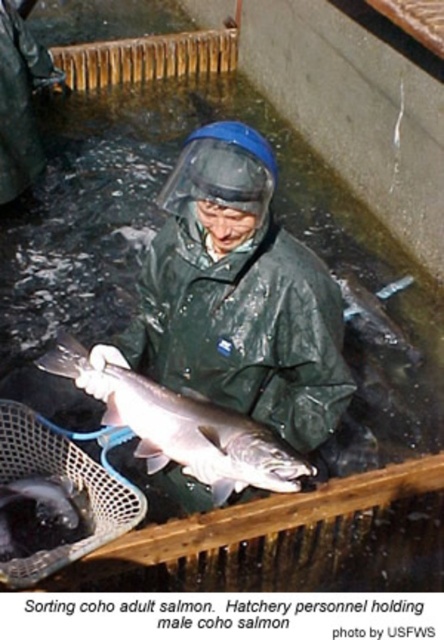
Question: Which point is closer to the camera?

Choices:
 (A) shiny black fish at lower left
 (B) shiny silver fish at center
 (C) green matte jacket at center

Answer: (B)

Question: Can you confirm if shiny silver fish at center is smaller than shiny black fish at lower left?

Choices:
 (A) no
 (B) yes

Answer: (A)

Question: Which point is closer to the camera?

Choices:
 (A) shiny silver fish at center
 (B) shiny black fish at lower left
 (C) green matte jacket at center

Answer: (A)

Question: Among these objects, which one is nearest to the camera?

Choices:
 (A) shiny silver fish at center
 (B) green matte jacket at center
 (C) shiny black fish at lower left

Answer: (A)

Question: Is green matte jacket at center closer to camera compared to shiny silver fish at center?

Choices:
 (A) yes
 (B) no

Answer: (B)

Question: Does green matte jacket at center have a larger size compared to shiny silver fish at center?

Choices:
 (A) yes
 (B) no

Answer: (A)